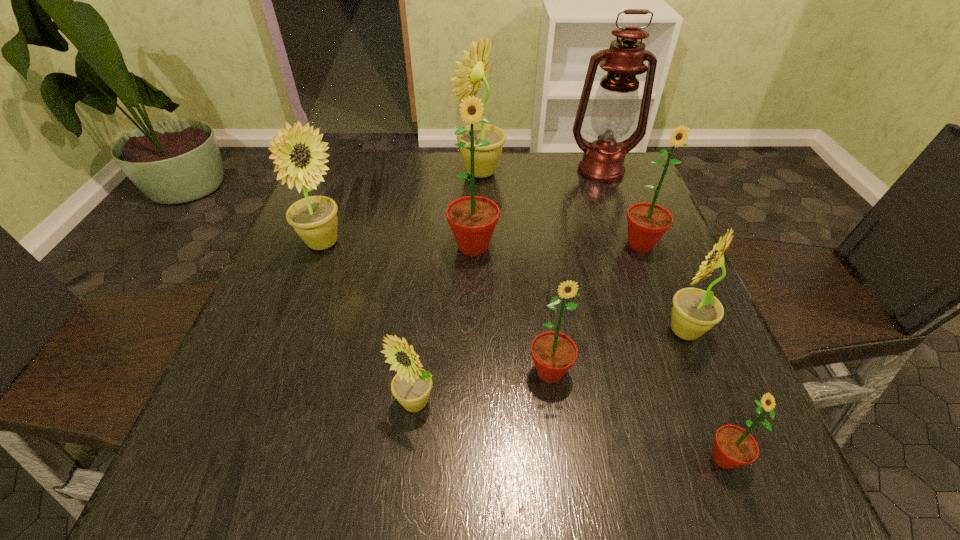
Where is `vacant space at the far left corner of the desktop`? vacant space at the far left corner of the desktop is located at coordinates (372, 169).

The height and width of the screenshot is (540, 960). I want to click on blank space at the near right corner of the desktop, so [676, 486].

I want to click on free space between the smallest yellow sunflower and the red oil lamp, so click(x=508, y=287).

This screenshot has height=540, width=960. Identify the location of free space between the second nearest green sunflower and the third biggest yellow sunflower. (617, 352).

This screenshot has width=960, height=540. I want to click on vacant space that is in between the red oil lamp and the leftmost green sunflower, so click(537, 209).

Locate an element on the screen. This screenshot has width=960, height=540. vacant region between the nearest green sunflower and the leftmost yellow sunflower is located at coordinates (523, 351).

The height and width of the screenshot is (540, 960). I want to click on vacant space in between the red oil lamp and the second nearest green sunflower, so click(x=575, y=272).

Where is `blank region between the second yellow sunflower from right to left and the second biggest green sunflower`? The width and height of the screenshot is (960, 540). blank region between the second yellow sunflower from right to left and the second biggest green sunflower is located at coordinates (561, 208).

Where is `unoccupied area between the smallest green sunflower and the third farthest green sunflower`? The image size is (960, 540). unoccupied area between the smallest green sunflower and the third farthest green sunflower is located at coordinates (637, 415).

Image resolution: width=960 pixels, height=540 pixels. In order to click on free space between the second biggest yellow sunflower and the fifth object from right to left in this screenshot , I will do `click(437, 308)`.